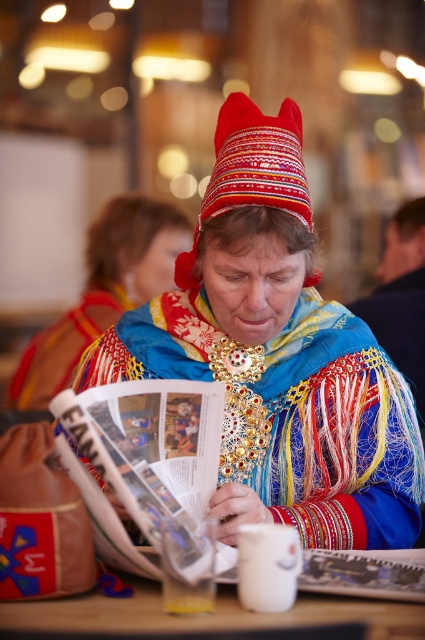
You are a photographer trying to capture the multicolored woven scarf at center in your shot. The camera is positioned at the edge of the table where the white mug is placed. Can you determine if the scarf is within the camera frame?

The multicolored woven scarf at center is located at point (277, 355), which is within the camera frame since it is centered and the camera is positioned at the edge of the table where the white mug is placed.

You are a photographer trying to capture the multicolored woven scarf at center in focus. The camera you are using has a depth of field that can only sharply focus on objects within 3 feet. Will the scarf be in focus?

The multicolored woven scarf at center is 3.64 feet from camera, which is beyond the camera lens depth of field of 3 feet. Therefore, the scarf will not be in focus.